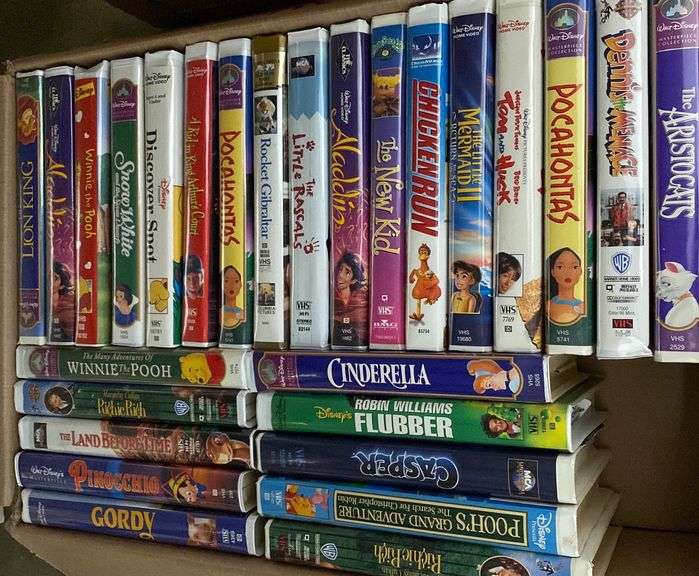
You are a GUI agent. You are given a task and a screenshot of the screen. Output one action in this format:
    pyautogui.click(x=<x>, y=<y>)
    Task: Click on the vhs tapes stacked horizontally
    
    Given the screenshot: What is the action you would take?
    pyautogui.click(x=431, y=374), pyautogui.click(x=428, y=416), pyautogui.click(x=419, y=465), pyautogui.click(x=394, y=509), pyautogui.click(x=340, y=551), pyautogui.click(x=196, y=530), pyautogui.click(x=212, y=491), pyautogui.click(x=217, y=448), pyautogui.click(x=229, y=374), pyautogui.click(x=224, y=414)